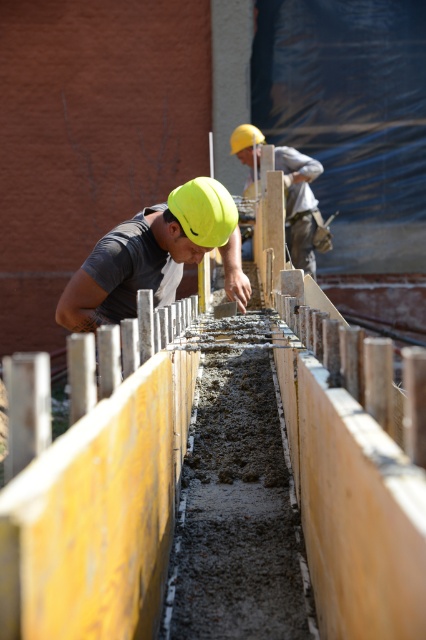
Question: Does neon yellow hard hat at center lie in front of yellow hard hat at center?

Choices:
 (A) yes
 (B) no

Answer: (A)

Question: Is neon yellow hard hat at center below yellow hard hat at center?

Choices:
 (A) yes
 (B) no

Answer: (A)

Question: Is the position of neon yellow hard hat at center less distant than that of yellow hard hat at center?

Choices:
 (A) yes
 (B) no

Answer: (A)

Question: Which point appears closest to the camera in this image?

Choices:
 (A) (x=296, y=179)
 (B) (x=232, y=262)

Answer: (B)

Question: Which point is farther to the camera?

Choices:
 (A) neon yellow hard hat at center
 (B) yellow hard hat at center

Answer: (B)